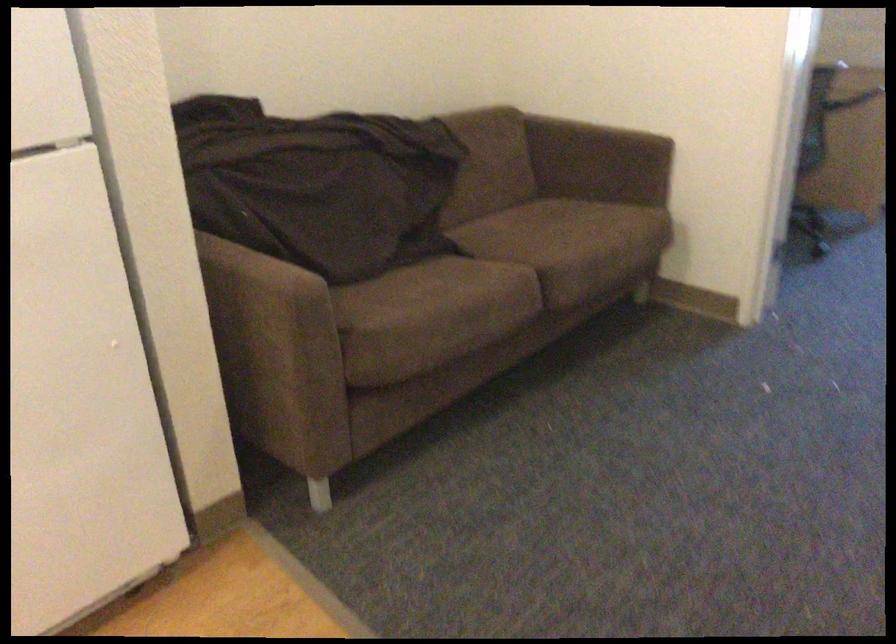
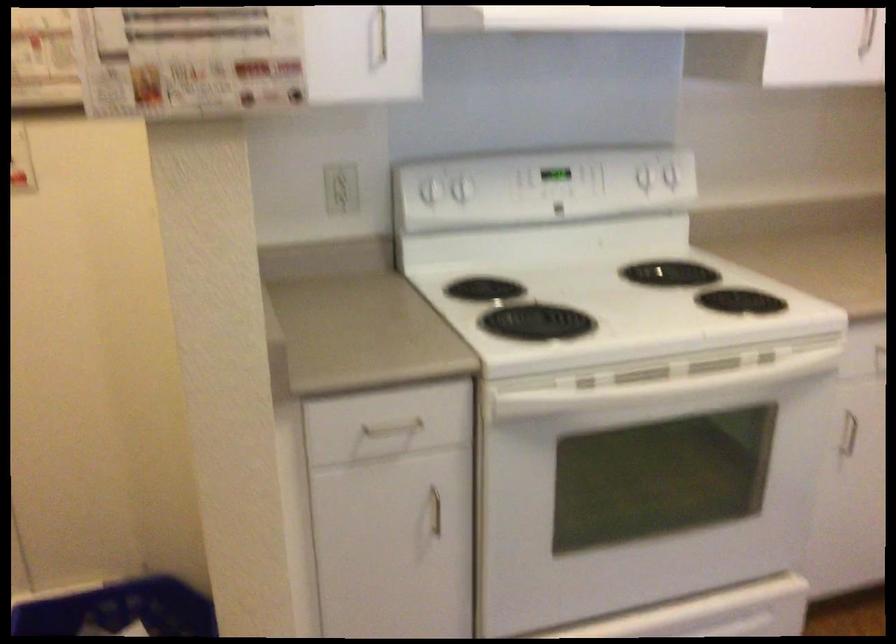
The images are taken continuously from a first-person perspective. In which direction is your viewpoint rotating?

The camera rotated toward left-down.